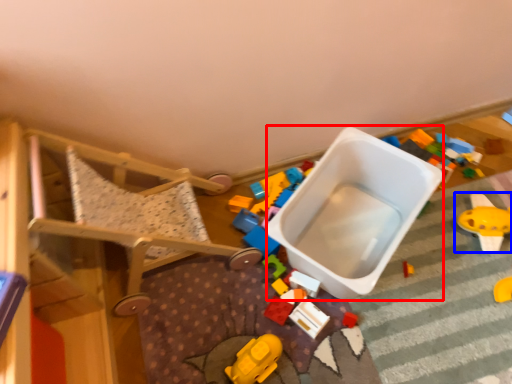
Question: Among these objects, which one is farthest to the camera, storage box (highlighted by a red box) or toy (highlighted by a blue box)?

Choices:
 (A) storage box
 (B) toy

Answer: (B)